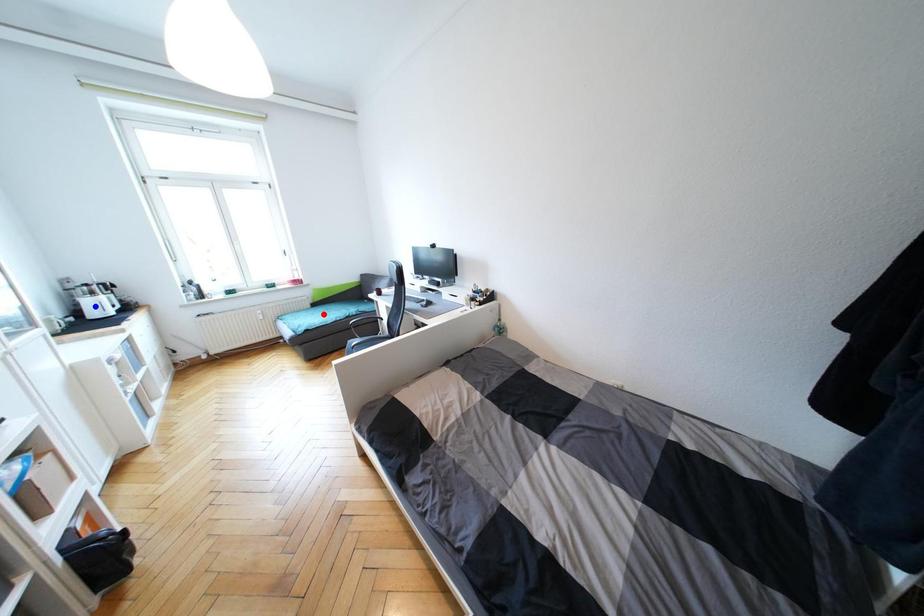
Question: Which of the two points in the image is closer to the camera?

Choices:
 (A) Blue point is closer.
 (B) Red point is closer.

Answer: (A)